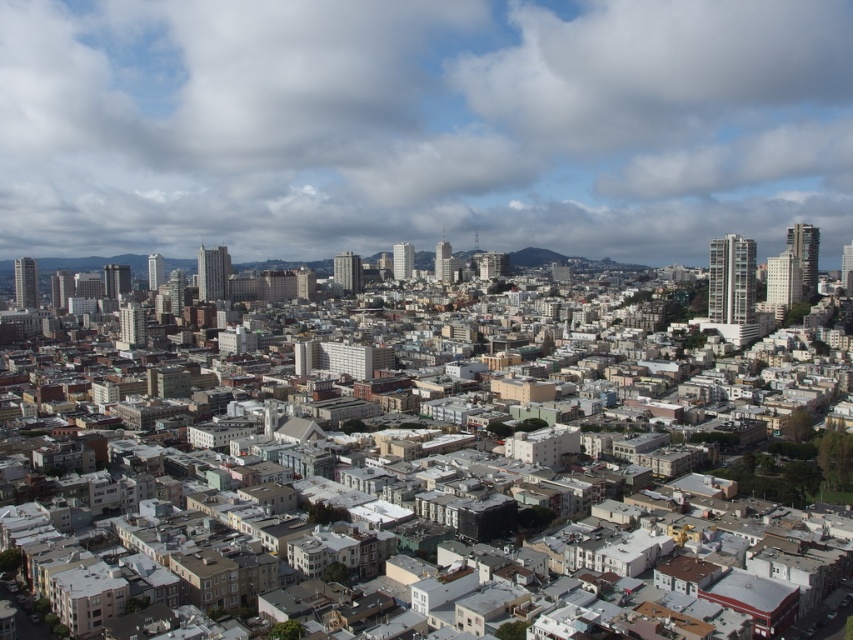
Between white fluffy cloud at upper center and green grassy hillside at center, which one appears on the left side from the viewer's perspective?

Positioned to the left is white fluffy cloud at upper center.

Can you confirm if white fluffy cloud at upper center is positioned above green grassy hillside at center?

Yes.

Between point (410, 68) and point (534, 259), which one is positioned behind?

The point (410, 68) is more distant.

Identify the location of white fluffy cloud at upper center. This screenshot has width=853, height=640. (422, 125).